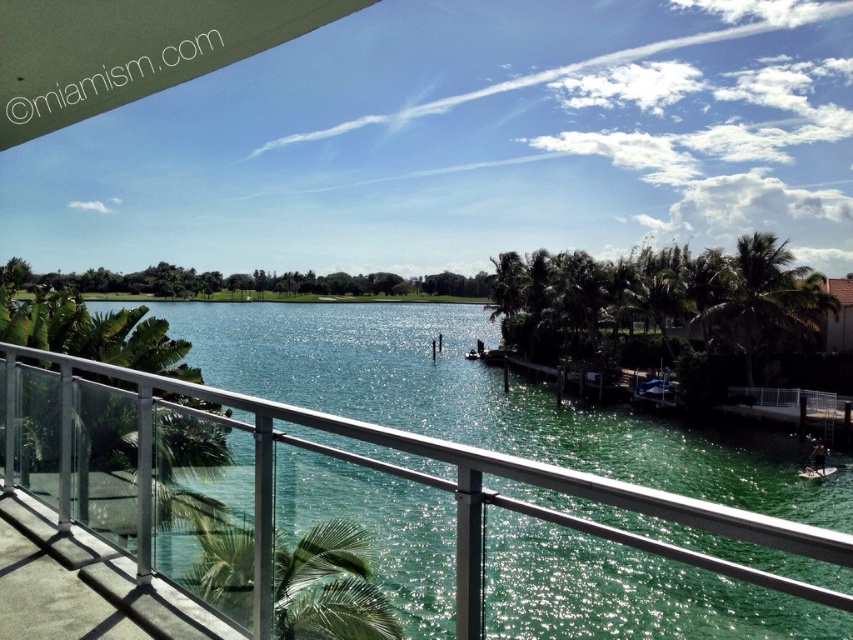
Question: Which object is closer to the camera taking this photo?

Choices:
 (A) green leafy palm tree at lower left
 (B) green leafy palm tree at right
 (C) white plastic boat at lower right

Answer: (A)

Question: Does clear glass railing at center have a lesser width compared to green leafy palm tree at right?

Choices:
 (A) no
 (B) yes

Answer: (A)

Question: Based on their relative distances, which object is farther from the green leafy palm tree at lower left?

Choices:
 (A) white plastic boat at lower right
 (B) clear glass railing at center

Answer: (A)

Question: Is green leafy palm tree at right below white plastic boat at lower right?

Choices:
 (A) no
 (B) yes

Answer: (A)

Question: Is green leafy palm tree at lower left positioned at the back of green leafy palm tree at right?

Choices:
 (A) yes
 (B) no

Answer: (B)

Question: Which is farther from the green leafy palm tree at lower left?

Choices:
 (A) clear glass railing at center
 (B) white plastic boat at lower right
 (C) green leafy palm tree at right

Answer: (C)